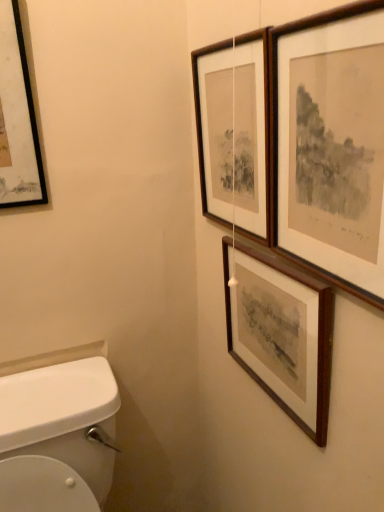
Question: Is wooden picture frame at upper right, the third picture frame from the left, with wooden framed print at upper right, marked as the 1th picture frame in a right-to-left arrangement?

Choices:
 (A) yes
 (B) no

Answer: (B)

Question: Is wooden picture frame at upper right, the third picture frame from the left, thinner than wooden framed print at upper right, the 4th picture frame in the left-to-right sequence?

Choices:
 (A) yes
 (B) no

Answer: (B)

Question: Is wooden picture frame at upper right, the third picture frame from the left, completely or partially outside of wooden framed print at upper right, marked as the 1th picture frame in a right-to-left arrangement?

Choices:
 (A) no
 (B) yes

Answer: (B)

Question: Does wooden picture frame at upper right, the second picture frame from the right, have a larger size compared to wooden framed print at upper right, marked as the 1th picture frame in a right-to-left arrangement?

Choices:
 (A) no
 (B) yes

Answer: (B)

Question: From the image's perspective, is wooden picture frame at upper right, the second picture frame from the right, on top of wooden framed print at upper right, the 4th picture frame in the left-to-right sequence?

Choices:
 (A) yes
 (B) no

Answer: (B)

Question: Considering the relative sizes of wooden picture frame at upper right, the third picture frame from the left, and wooden framed print at upper right, the 4th picture frame in the left-to-right sequence, in the image provided, is wooden picture frame at upper right, the third picture frame from the left, wider than wooden framed print at upper right, the 4th picture frame in the left-to-right sequence,?

Choices:
 (A) yes
 (B) no

Answer: (A)

Question: From the image's perspective, is wooden picture frame at upper right, which is the 3th picture frame from right to left, on black matte picture frame at upper left, positioned as the first picture frame in left-to-right order?

Choices:
 (A) no
 (B) yes

Answer: (A)

Question: Is wooden picture frame at upper right, which is the 3th picture frame from right to left, bigger than black matte picture frame at upper left, which is counted as the fourth picture frame, starting from the right?

Choices:
 (A) yes
 (B) no

Answer: (A)

Question: Is wooden picture frame at upper right, which ranks as the second picture frame in left-to-right order, taller than black matte picture frame at upper left, positioned as the first picture frame in left-to-right order?

Choices:
 (A) no
 (B) yes

Answer: (A)

Question: Can you confirm if wooden picture frame at upper right, which is the 3th picture frame from right to left, is smaller than black matte picture frame at upper left, which is counted as the fourth picture frame, starting from the right?

Choices:
 (A) no
 (B) yes

Answer: (A)

Question: From the image's perspective, is wooden picture frame at upper right, which is the 3th picture frame from right to left, under black matte picture frame at upper left, which is counted as the fourth picture frame, starting from the right?

Choices:
 (A) no
 (B) yes

Answer: (B)

Question: Is wooden picture frame at upper right, which ranks as the second picture frame in left-to-right order, positioned with its back to black matte picture frame at upper left, which is counted as the fourth picture frame, starting from the right?

Choices:
 (A) yes
 (B) no

Answer: (B)

Question: Is the surface of wooden picture frame at upper right, which is the 3th picture frame from right to left, in direct contact with wooden framed print at upper right, marked as the 1th picture frame in a right-to-left arrangement?

Choices:
 (A) yes
 (B) no

Answer: (B)